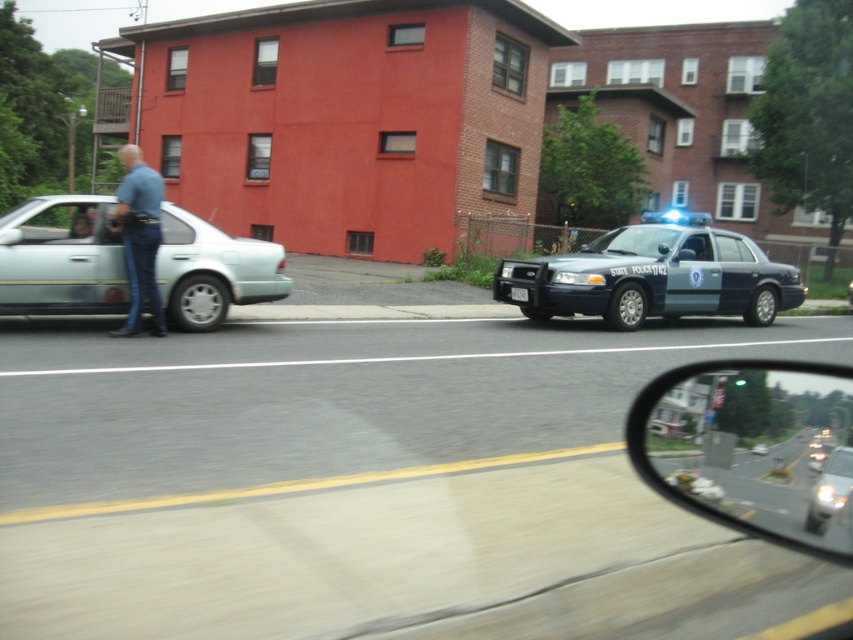
Question: Can you confirm if clear glass side mirror at lower right is wider than silver metallic sedan at left?

Choices:
 (A) yes
 (B) no

Answer: (B)

Question: Which point is farther to the camera?

Choices:
 (A) (770, 528)
 (B) (140, 218)
 (C) (556, 296)

Answer: (C)

Question: Which point appears farthest from the camera in this image?

Choices:
 (A) [701, 276]
 (B) [148, 204]
 (C) [515, 298]
 (D) [833, 481]

Answer: (A)

Question: Does metallic blue police car at right have a smaller size compared to silver metallic sedan at right?

Choices:
 (A) yes
 (B) no

Answer: (B)

Question: Is blue denim jeans at left to the right of white plastic license plate at center from the viewer's perspective?

Choices:
 (A) no
 (B) yes

Answer: (A)

Question: Which point appears farthest from the camera in this image?

Choices:
 (A) (523, 291)
 (B) (155, 291)
 (C) (844, 465)

Answer: (A)